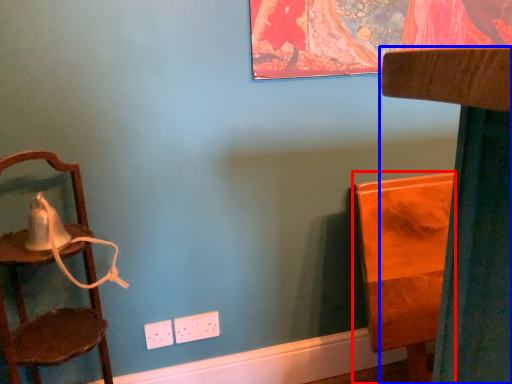
Question: Which of the following is the closest to the observer, furniture (highlighted by a red box) or furniture (highlighted by a blue box)?

Choices:
 (A) furniture
 (B) furniture

Answer: (B)